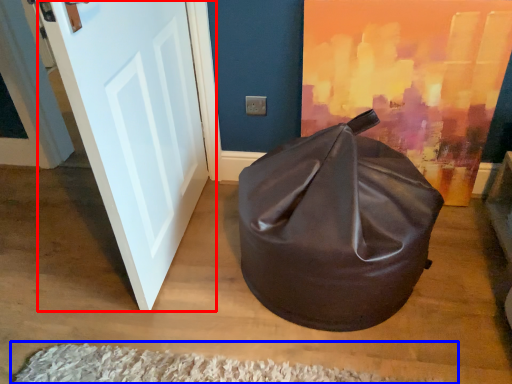
Question: Which point is further to the camera, door (highlighted by a red box) or doormat (highlighted by a blue box)?

Choices:
 (A) door
 (B) doormat

Answer: (B)